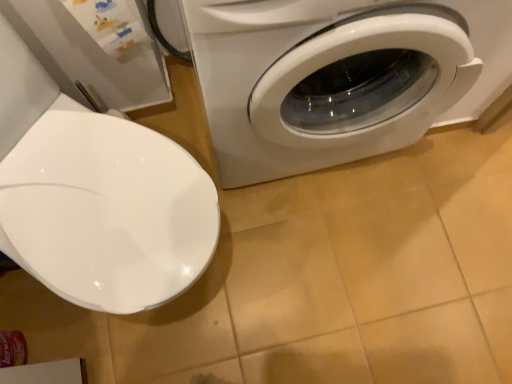
The width and height of the screenshot is (512, 384). In order to click on vacant area that lies to the right of white glossy toilet seat at left in this screenshot , I will do `click(279, 271)`.